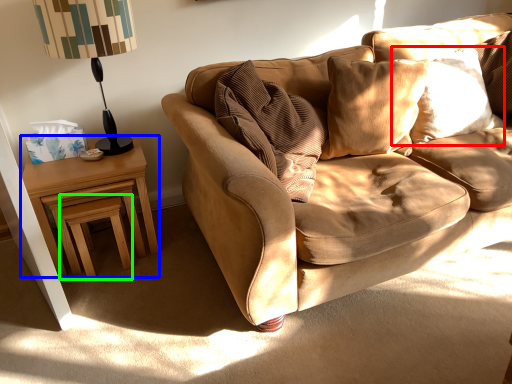
Question: Based on their relative distances, which object is nearer to pillow (highlighted by a red box)? Choose from nightstand (highlighted by a blue box) and stool (highlighted by a green box).

Choices:
 (A) nightstand
 (B) stool

Answer: (A)